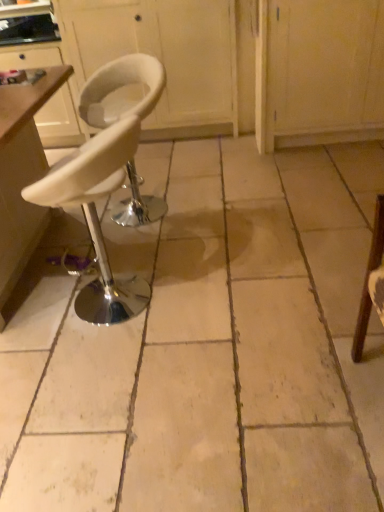
This screenshot has width=384, height=512. In order to click on white leather stool at center in this screenshot , I will do pos(207,346).

This screenshot has height=512, width=384. I want to click on white leather stool at center, so click(207, 346).

From the image's perspective, does white matte stool at left, the second chair in the back-to-front sequence, appear lower than white matte stool at center, which is the first chair from back to front?

Yes, from the image's perspective, white matte stool at left, the second chair in the back-to-front sequence, is beneath white matte stool at center, which is the first chair from back to front.

At what (x,y) coordinates should I click in order to perform the action: click on chair on the right of the white matte stool at left, the first chair in the front-to-back sequence. Please return your answer as a coordinate pair (x, y). Image resolution: width=384 pixels, height=512 pixels. Looking at the image, I should click on (120, 87).

Which is less distant, (63, 175) or (152, 69)?

Point (63, 175) is closer to the camera than point (152, 69).

Is white matte stool at left, the first chair in the front-to-back sequence, at the left side of white matte stool at center, the second chair in the front-to-back sequence?

Correct, you'll find white matte stool at left, the first chair in the front-to-back sequence, to the left of white matte stool at center, the second chair in the front-to-back sequence.

Does white matte stool at left, the second chair in the back-to-front sequence, lie behind white leather stool at center?

Yes, white matte stool at left, the second chair in the back-to-front sequence, is behind white leather stool at center.

Which is more to the left, white matte stool at left, the second chair in the back-to-front sequence, or white leather stool at center?

white matte stool at left, the second chair in the back-to-front sequence, is more to the left.

Choose the correct answer: Is white matte stool at left, the first chair in the front-to-back sequence, inside white leather stool at center or outside it?

white matte stool at left, the first chair in the front-to-back sequence, is outside white leather stool at center.

How distant is white matte stool at left, the second chair in the back-to-front sequence, from white leather stool at center?

The distance of white matte stool at left, the second chair in the back-to-front sequence, from white leather stool at center is 52.47 centimeters.

Consider the image. From the image's perspective, which is below, white matte cabinet at upper center or white plastic table at left?

From the image's view, white plastic table at left is below.

Is white matte cabinet at upper center facing away from white plastic table at left?

No, white matte cabinet at upper center is not facing away from white plastic table at left.

From a real-world perspective, is white matte cabinet at upper center under white plastic table at left?

Actually, white matte cabinet at upper center is physically above white plastic table at left in the real world.

This screenshot has height=512, width=384. Find the location of `cabinetry above the white plastic table at left (from the image's perspective)`. cabinetry above the white plastic table at left (from the image's perspective) is located at coordinates (163, 56).

From a real-world perspective, relative to white leather stool at center, is white plastic table at left vertically above or below?

Clearly, from a real-world perspective, white plastic table at left is above white leather stool at center.

How distant is white plastic table at left from white leather stool at center?

white plastic table at left is 32.99 inches from white leather stool at center.

Is white plastic table at left not close to white leather stool at center?

white plastic table at left is near white leather stool at center, not far away.

Is white plastic table at left outside of white leather stool at center?

white plastic table at left is positioned outside white leather stool at center.

In terms of width, does white leather stool at center look wider or thinner when compared to white matte stool at left, the first chair in the front-to-back sequence?

Clearly, white leather stool at center has more width compared to white matte stool at left, the first chair in the front-to-back sequence.

From a real-world perspective, who is located higher, white leather stool at center or white matte stool at left, the second chair in the back-to-front sequence?

From a 3D spatial view, white matte stool at left, the second chair in the back-to-front sequence, is above.

What's the angular difference between white leather stool at center and white matte stool at left, the second chair in the back-to-front sequence,'s facing directions?

The angular difference between white leather stool at center and white matte stool at left, the second chair in the back-to-front sequence, is 174 degrees.

The image size is (384, 512). In order to click on concrete located above the white matte stool at left, the second chair in the back-to-front sequence (from the image's perspective) in this screenshot , I will do `click(207, 346)`.

Is there a large distance between white matte cabinet at upper center and white leather stool at center?

Indeed, white matte cabinet at upper center is not near white leather stool at center.

Measure the distance from white matte cabinet at upper center to white leather stool at center.

white matte cabinet at upper center and white leather stool at center are 5.54 feet apart from each other.

From the image's perspective, is white matte cabinet at upper center positioned above or below white leather stool at center?

Clearly, from the image's perspective, white matte cabinet at upper center is above white leather stool at center.

Consider the image. Could you tell me if white matte cabinet at upper center is facing white leather stool at center?

Yes, white matte cabinet at upper center is aimed at white leather stool at center.

Is white matte stool at center, the second chair in the front-to-back sequence, beside white plastic table at left?

No, white matte stool at center, the second chair in the front-to-back sequence, is not next to white plastic table at left.

Considering the relative sizes of white matte stool at center, the second chair in the front-to-back sequence, and white plastic table at left in the image provided, is white matte stool at center, the second chair in the front-to-back sequence, thinner than white plastic table at left?

Yes, white matte stool at center, the second chair in the front-to-back sequence, is thinner than white plastic table at left.

Considering the sizes of objects white matte stool at center, the second chair in the front-to-back sequence, and white plastic table at left in the image provided, who is bigger, white matte stool at center, the second chair in the front-to-back sequence, or white plastic table at left?

white plastic table at left.

Based on the photo, which point is more forward, (149, 88) or (14, 221)?

Positioned in front is point (14, 221).

This screenshot has height=512, width=384. I want to click on chair beneath the white matte stool at left, the second chair in the back-to-front sequence (from a real-world perspective), so click(120, 87).

Identify the location of concrete above the white matte stool at left, the first chair in the front-to-back sequence (from the image's perspective). (207, 346).

Which object lies nearer to the anchor point white plastic table at left, white matte stool at center, the second chair in the front-to-back sequence, or white matte cabinet at upper center?

Among the two, white matte stool at center, the second chair in the front-to-back sequence, is located nearer to white plastic table at left.

Which object lies nearer to the anchor point white matte stool at left, the first chair in the front-to-back sequence, white leather stool at center or white matte cabinet at upper center?

white leather stool at center is closer to white matte stool at left, the first chair in the front-to-back sequence.

Looking at the image, which one is located closer to white matte stool at left, the first chair in the front-to-back sequence, white matte stool at center, which is the first chair from back to front, or white plastic table at left?

white plastic table at left is positioned closer to the anchor white matte stool at left, the first chair in the front-to-back sequence.

When comparing their distances from white matte stool at center, the second chair in the front-to-back sequence, does white plastic table at left or white leather stool at center seem further?

white leather stool at center.

Considering their positions, is white matte cabinet at upper center positioned further to white leather stool at center than white plastic table at left?

white matte cabinet at upper center lies further to white leather stool at center than the other object.

Consider the image. Estimate the real-world distances between objects in this image. Which object is closer to white leather stool at center, white matte cabinet at upper center or white matte stool at left, the first chair in the front-to-back sequence?

white matte stool at left, the first chair in the front-to-back sequence, is closer to white leather stool at center.

Looking at the image, which one is located closer to white matte cabinet at upper center, white leather stool at center or white matte stool at left, the first chair in the front-to-back sequence?

white matte stool at left, the first chair in the front-to-back sequence, is closer to white matte cabinet at upper center.

When comparing their distances from white plastic table at left, does white leather stool at center or white matte stool at left, the first chair in the front-to-back sequence, seem further?

Based on the image, white leather stool at center appears to be further to white plastic table at left.

The height and width of the screenshot is (512, 384). In order to click on table located between white matte stool at left, the first chair in the front-to-back sequence, and white matte stool at center, which is the first chair from back to front, in the depth direction in this screenshot , I will do `click(22, 175)`.

Locate an element on the screen. This screenshot has width=384, height=512. chair between white leather stool at center and white matte stool at center, which is the first chair from back to front, along the z-axis is located at coordinates (97, 217).

Identify the location of chair between white plastic table at left and white matte cabinet at upper center from front to back. This screenshot has width=384, height=512. (120, 87).

The height and width of the screenshot is (512, 384). What are the coordinates of `table positioned between white leather stool at center and white matte cabinet at upper center from near to far` in the screenshot? It's located at (22, 175).